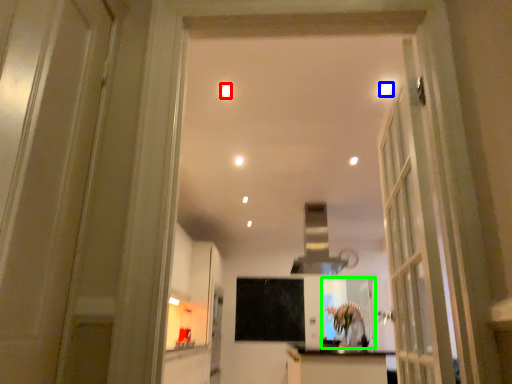
Question: Considering the real-world distances, which object is farthest from lighting (highlighted by a red box)? lighting (highlighted by a blue box) or mirror (highlighted by a green box)?

Choices:
 (A) lighting
 (B) mirror

Answer: (B)